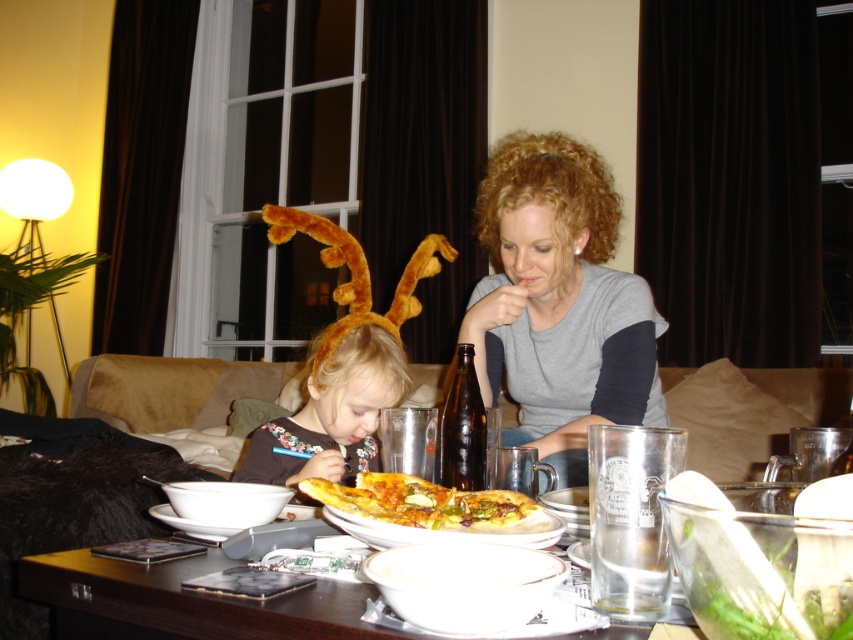
You are a photographer taking a picture of the scene. You want to ensure that both the gray matte shirt at center and the white matte plate at lower center are clearly visible in the photo. Which object should you focus on first to ensure proper depth of field?

The gray matte shirt at center is located above the white matte plate at lower center, so focusing on the gray matte shirt at center first will ensure both objects are in focus due to their vertical alignment.